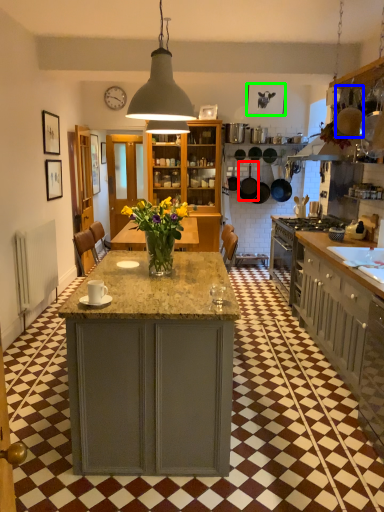
Question: Which object is positioned farthest from frying pan (highlighted by a red box)? Select from frying pan (highlighted by a blue box) and picture frame (highlighted by a green box).

Choices:
 (A) frying pan
 (B) picture frame

Answer: (A)